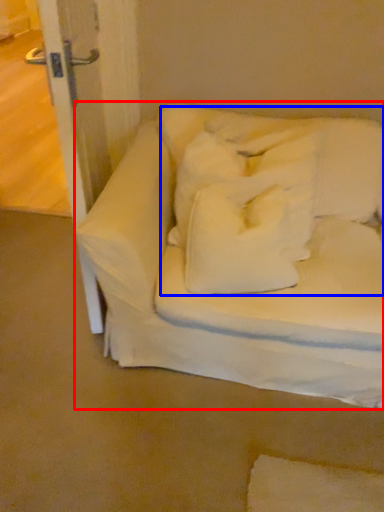
Question: Which point is further to the camera, furniture (highlighted by a red box) or bedding (highlighted by a blue box)?

Choices:
 (A) furniture
 (B) bedding

Answer: (B)